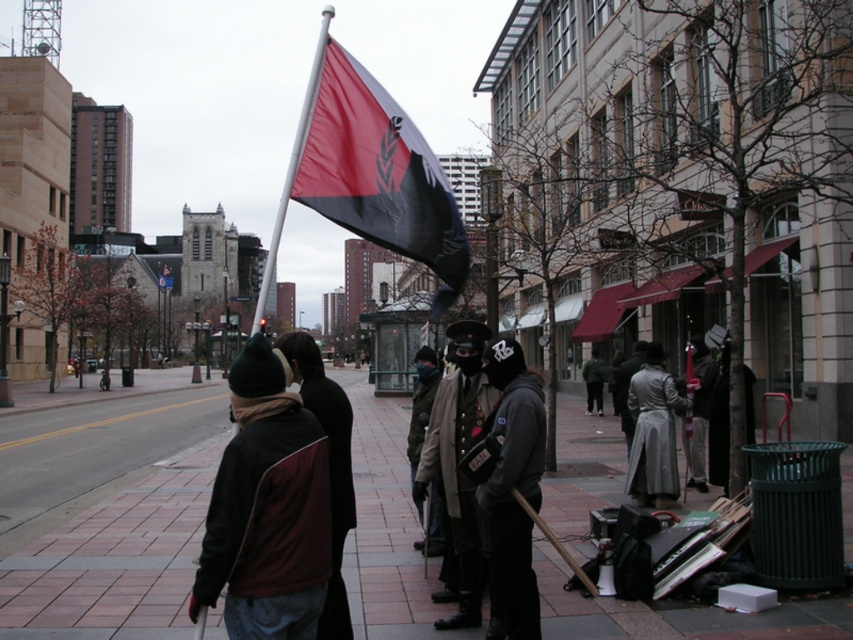
You are a photographer standing in the crowd and want to take a photo of both point (479, 426) and point (335, 490). Which point is closer to you?

Point (479, 426) is closer to you because it is further to the viewer than point (335, 490).

You are a photographer trying to capture the protest scene. You notice the black matte flag at center and the silver metallic flag pole at upper center. Which object has a smaller width when viewed from your camera angle?

The black matte flag at center has a smaller width than the silver metallic flag pole at upper center according to the description.

You are a photographer standing at the center of the sidewalk. You want to take a photo that includes both the flagpole and the person in the green beanie. The flagpole is at point (x=567, y=467) and the person in green beanie is at point (x=422, y=490). Which point should you focus on first to ensure both are in frame?

Point (x=567, y=467) is behind point (x=422, y=490), so you should focus on the closer point (x=422, y=490) first to ensure both are in frame.